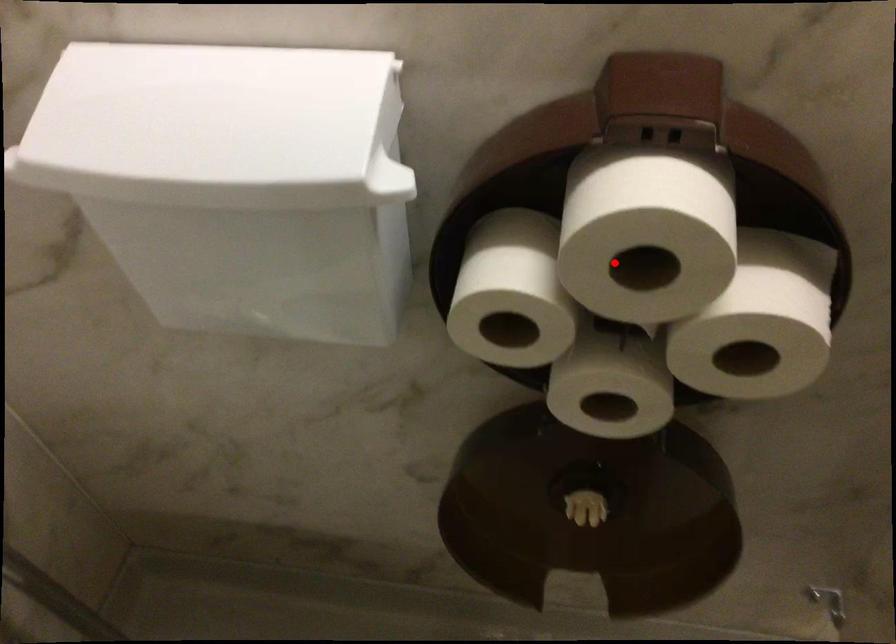
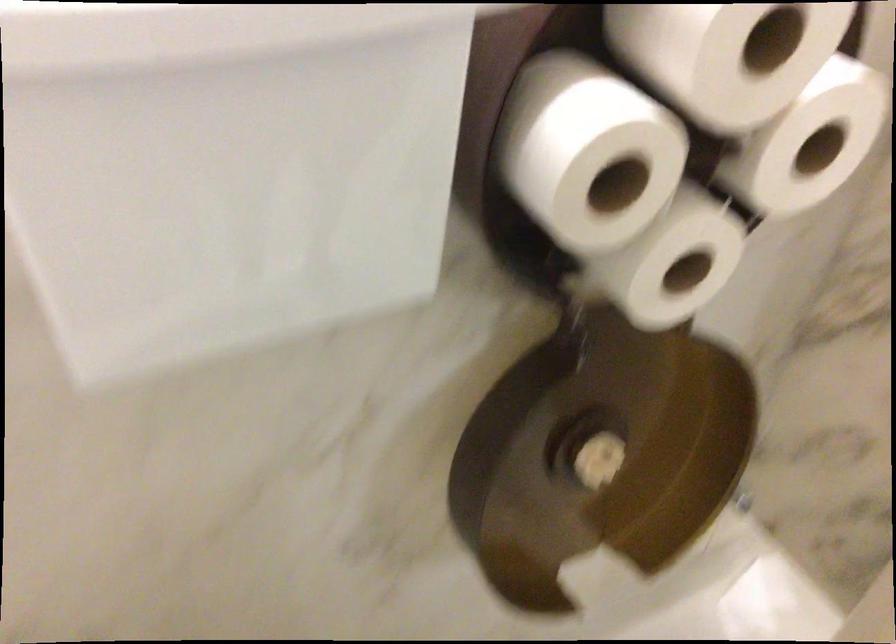
In the second image, find the point that corresponds to the highlighted location in the first image.

(727, 55)